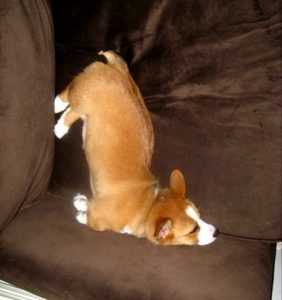
Locate an element on the screen. The image size is (282, 300). brown cushion arm rest is located at coordinates (23, 158).